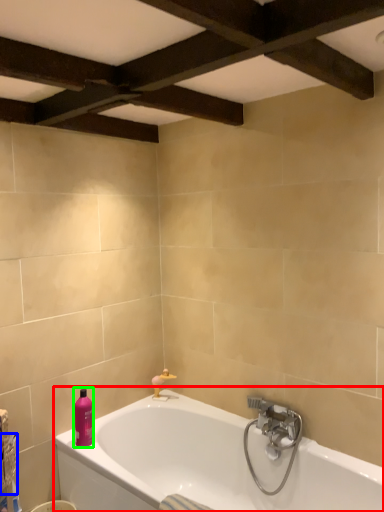
Question: Considering the real-world distances, which object is farthest from bathtub (highlighted by a red box)? basket (highlighted by a blue box) or toiletry (highlighted by a green box)?

Choices:
 (A) basket
 (B) toiletry

Answer: (A)